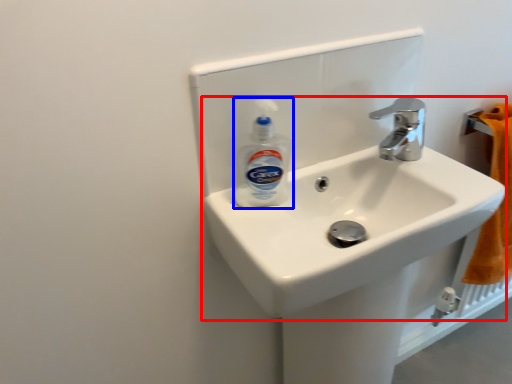
Question: Which of the following is the closest to the observer, sink (highlighted by a red box) or cleaning product (highlighted by a blue box)?

Choices:
 (A) sink
 (B) cleaning product

Answer: (A)